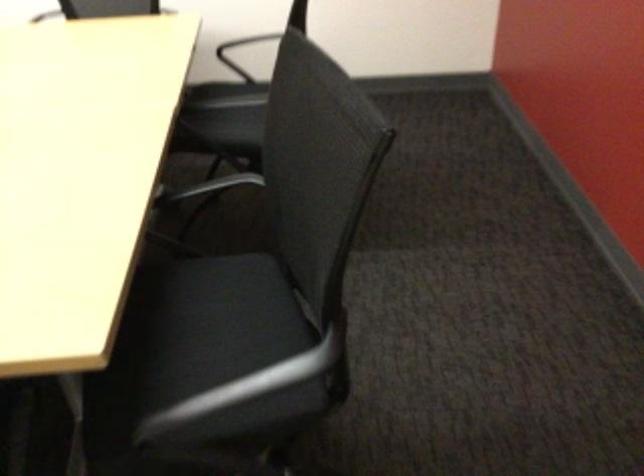
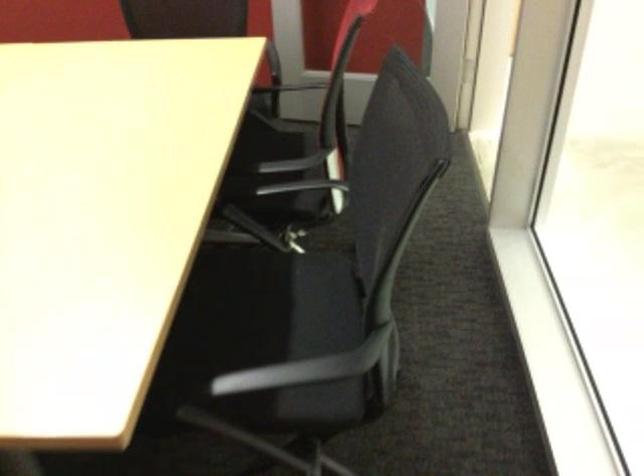
Question: I am providing you with two images of the same scene from different viewpoints. Which of the following objects are not visible in image2?

Choices:
 (A) chair sitting surface
 (B) black chair sitting surface
 (C) black chair armrest
 (D) folding step stool

Answer: (B)